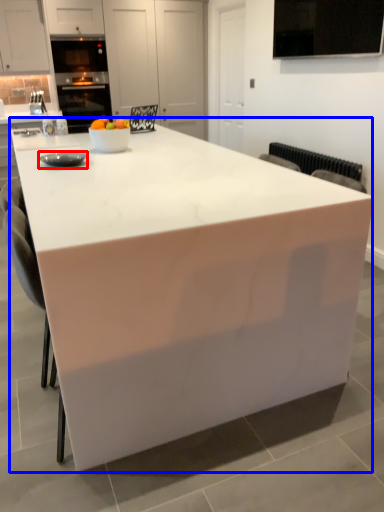
Question: Which object is further to the camera taking this photo, appliance (highlighted by a red box) or table (highlighted by a blue box)?

Choices:
 (A) appliance
 (B) table

Answer: (A)